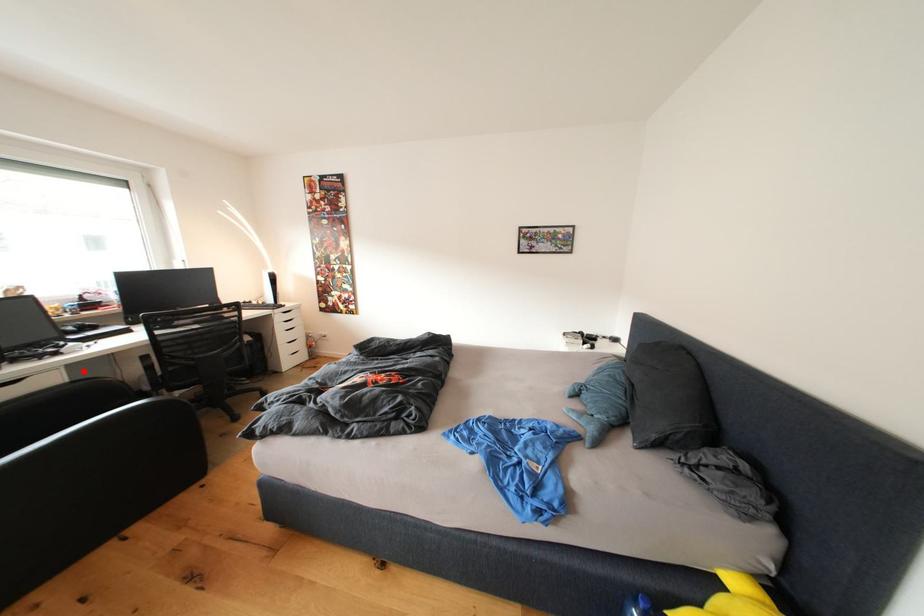
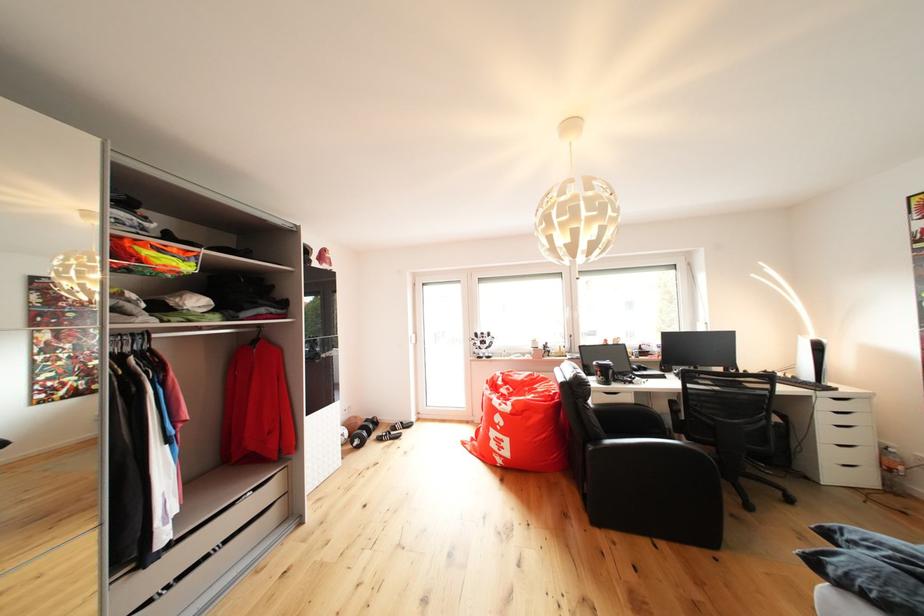
Find the pixel in the second image that matches the highlighted location in the first image.

(647, 399)